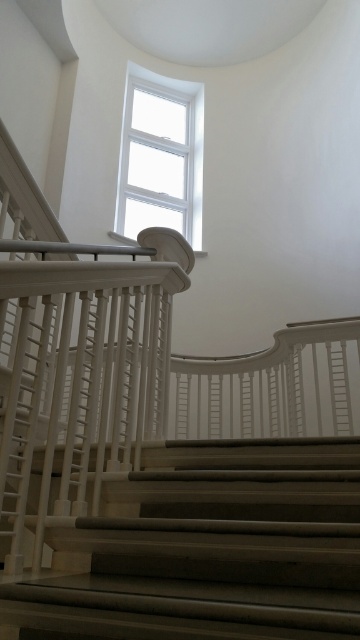
Question: Which object is farther from the camera taking this photo?

Choices:
 (A) white glass window at upper center
 (B) smooth beige stairs at center

Answer: (A)

Question: Does smooth beige stairs at center have a smaller size compared to white glass window at upper center?

Choices:
 (A) no
 (B) yes

Answer: (B)

Question: Can you confirm if smooth beige stairs at center is positioned to the left of white glass window at upper center?

Choices:
 (A) yes
 (B) no

Answer: (B)

Question: Is smooth beige stairs at center in front of white glass window at upper center?

Choices:
 (A) yes
 (B) no

Answer: (A)